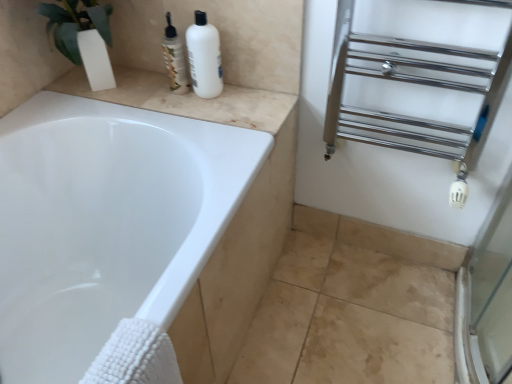
Locate an element on the screen. empty space that is ontop of beige marble counter top at upper left (from a real-world perspective) is located at coordinates (184, 95).